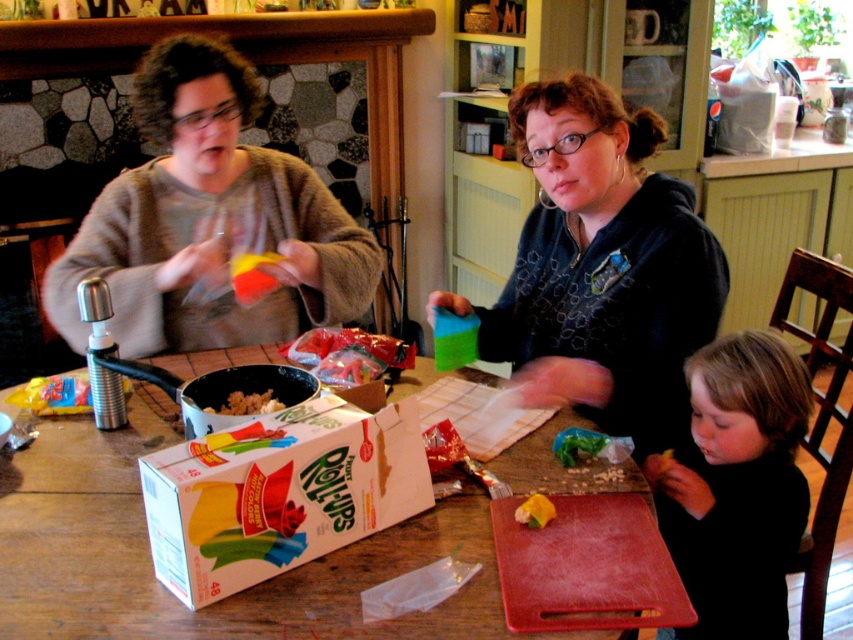
You are organizing items on a table in a kitchen. You have a matte black hoodie at center and a white cardboard box at center. Where should you place a new item so it won

The matte black hoodie at center is above the white cardboard box at center, so placing the new item below the hoodie but above the box would ensure it stays within the existing arrangement.

You are a chef who needs to place a 15 inch long rolling pin on the table. The wooden table at center is where you are standing. There is a matte gray sweater at left nearby. Can you place the rolling pin horizontally on the table without it overlapping the sweater?

The wooden table at center and matte gray sweater at left are 16.53 inches apart. Since the rolling pin is 15 inches long, which is shorter than the distance between them, you can place it horizontally on the table without overlapping the sweater.